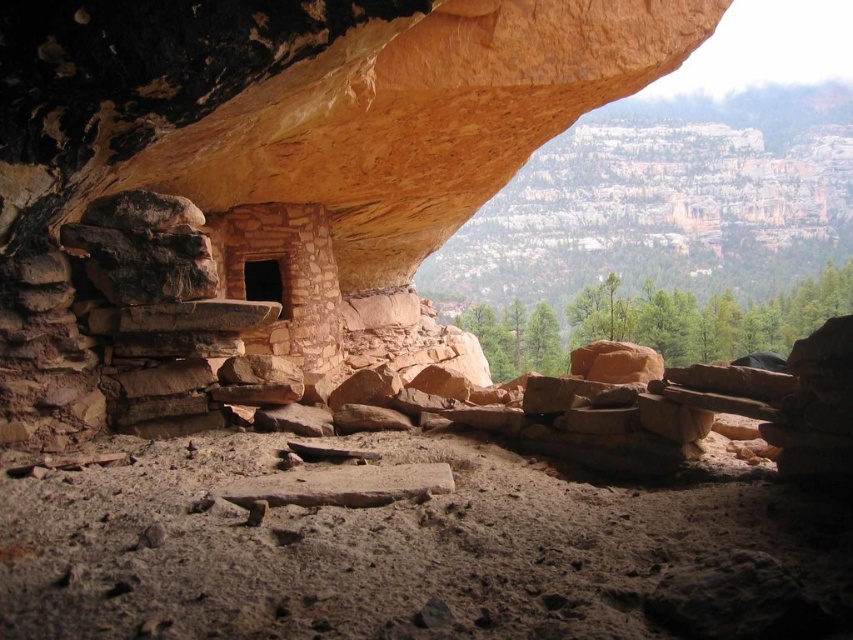
You are standing at the entrance of the cave and want to reach the rustic stone shelter at center. Which direction should you move to get there?

Since the rustic stone shelter at center is located at point [262,173], you should move towards the center of the cave from the entrance to reach it.

You are standing at the entrance of the cave and see two points marked inside the ancient stone structure. Which point is closer to you, point (271, 301) or point (254, 262)?

Point (271, 301) is in front of point (254, 262), so it is closer to you.